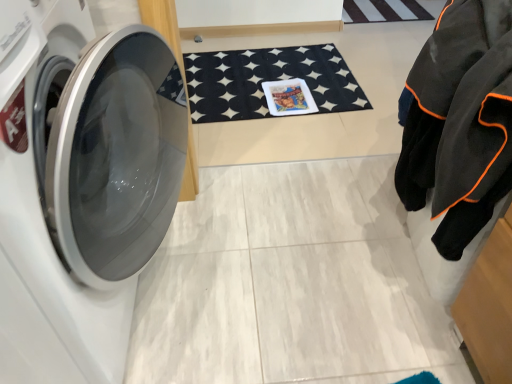
Identify the location of vacant region below black felt bath mat at center (from a real-world perspective). (264, 77).